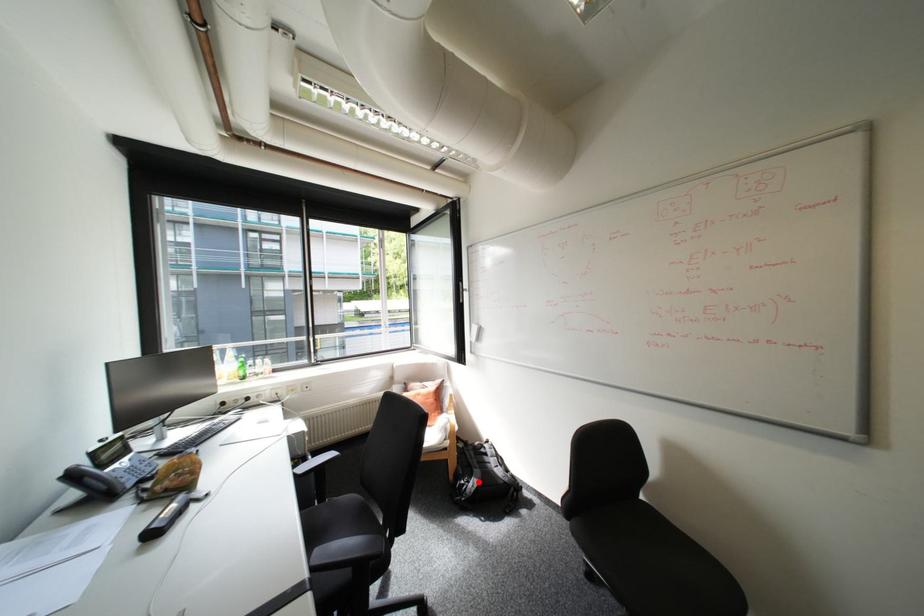
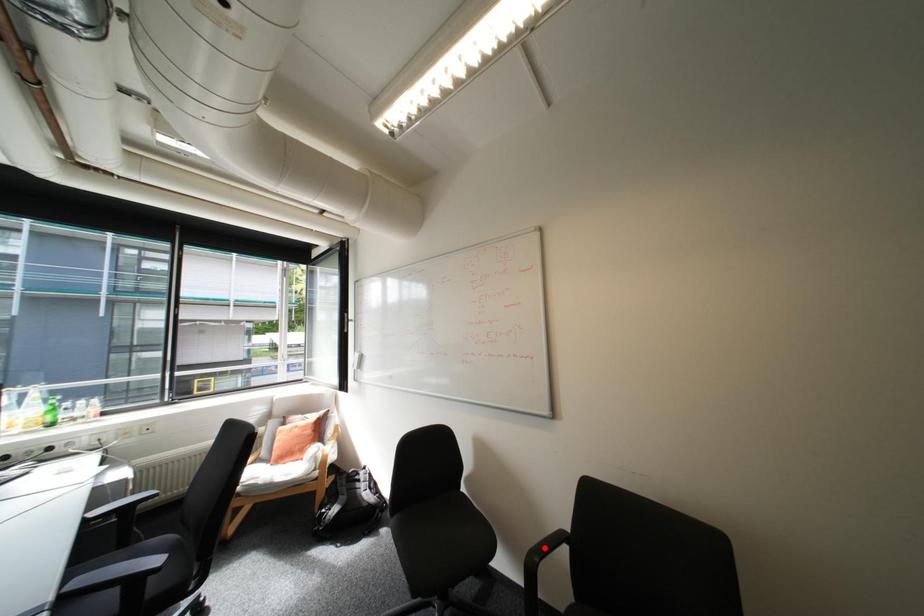
I am providing you with two images of the same scene from different viewpoints. A red point is marked on the first image and another point is marked on the second image. Does the point marked in image1 correspond to the same location as the one in image2?

No